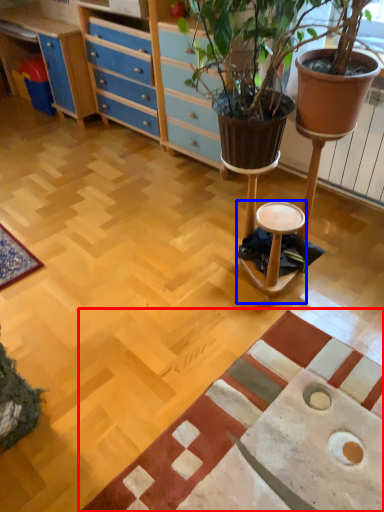
Question: Among these objects, which one is nearest to the camera, mat (highlighted by a red box) or stool (highlighted by a blue box)?

Choices:
 (A) mat
 (B) stool

Answer: (A)